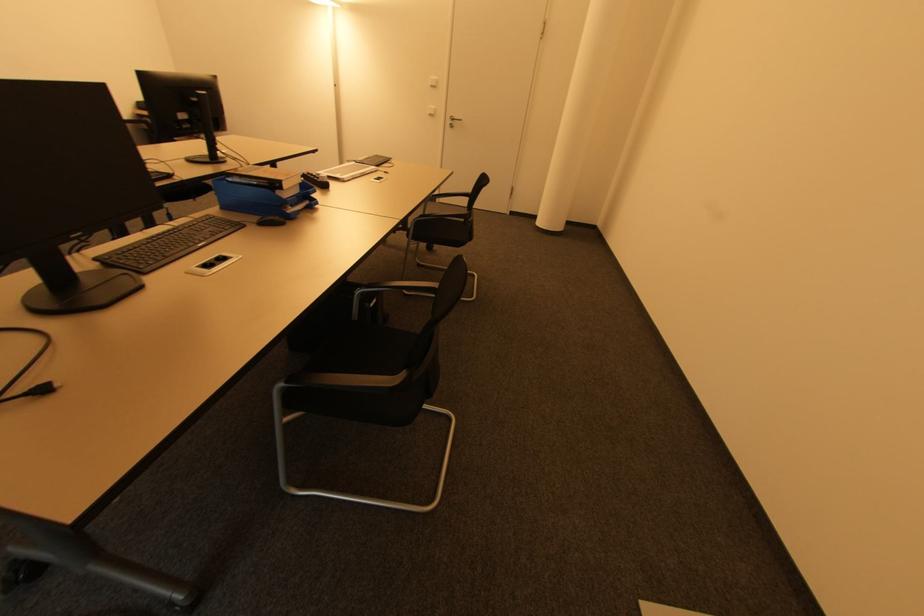
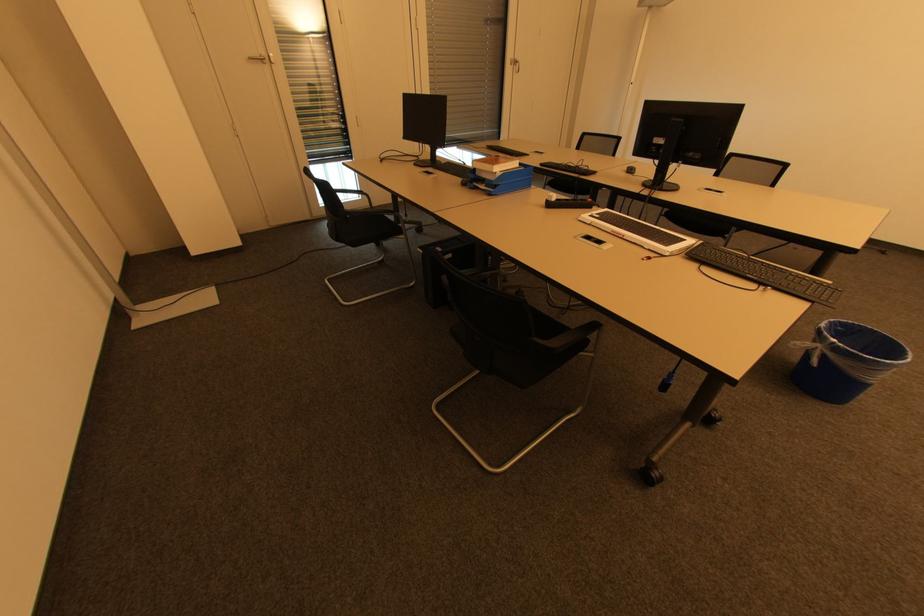
The point at [215,156] is marked in the first image. Where is the corresponding point in the second image?

(660, 183)